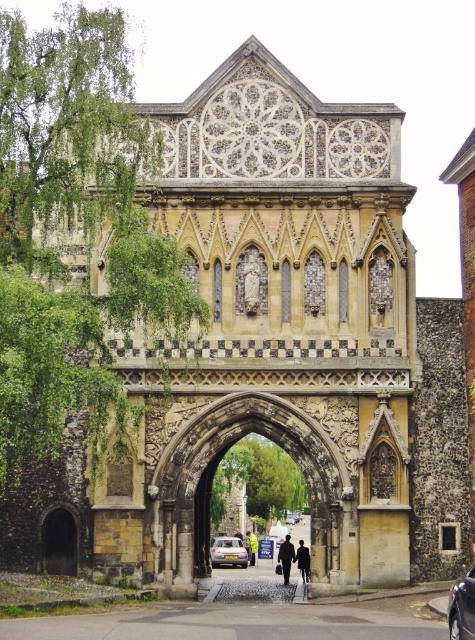
You are standing in front of the historic stone archway and see two cars labeled as metallic silver car at center and silver metallic car at center. Which car is closer to you?

The metallic silver car at center is closer to you because it is positioned closer to the viewer than the silver metallic car at center.

You are standing in front of the stone textured archway at center and want to hang the dark blue fabric coat at center on a hook located behind the archway. Can you reach the hook behind the archway without moving the coat?

The stone textured archway at center is closer to the viewer than the dark blue fabric coat at center, so the coat is further away. Since the hook is behind the archway, you would need to move the coat out of the way to access the hook.